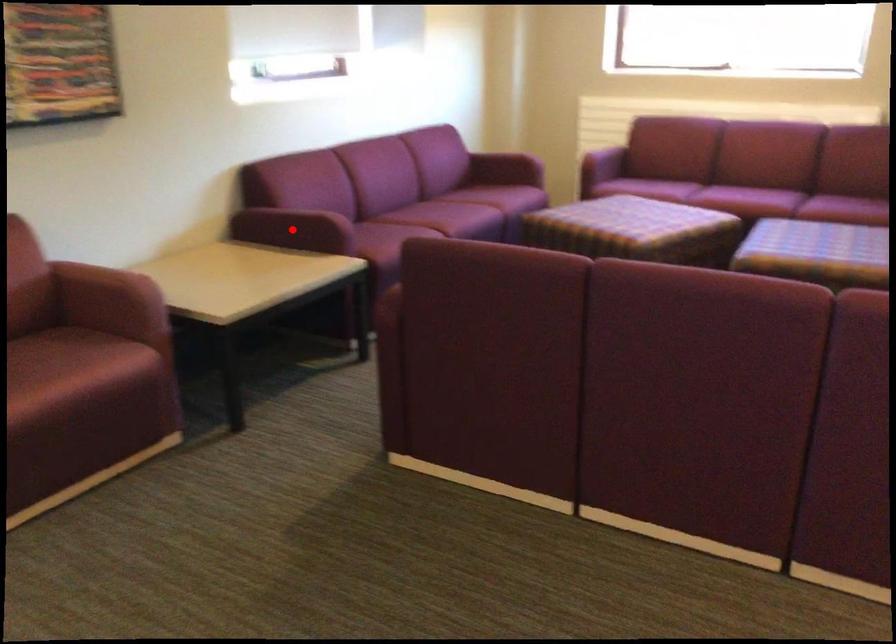
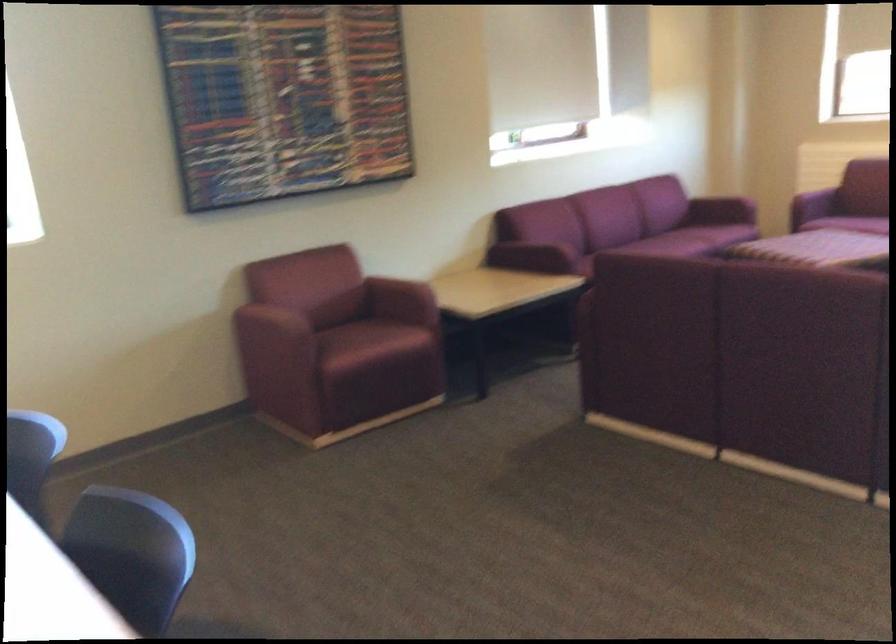
In the second image, find the point that corresponds to the highlighted location in the first image.

(530, 257)